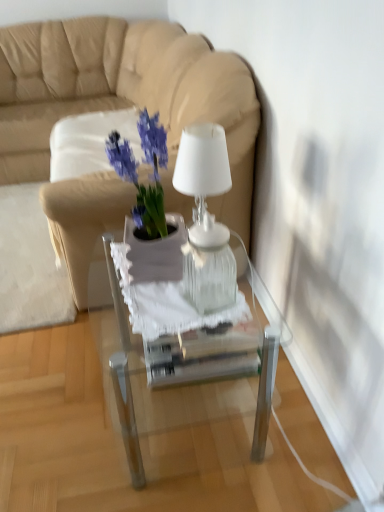
The height and width of the screenshot is (512, 384). Find the location of `free space that is to the left of clear glass table at center`. free space that is to the left of clear glass table at center is located at coordinates (66, 400).